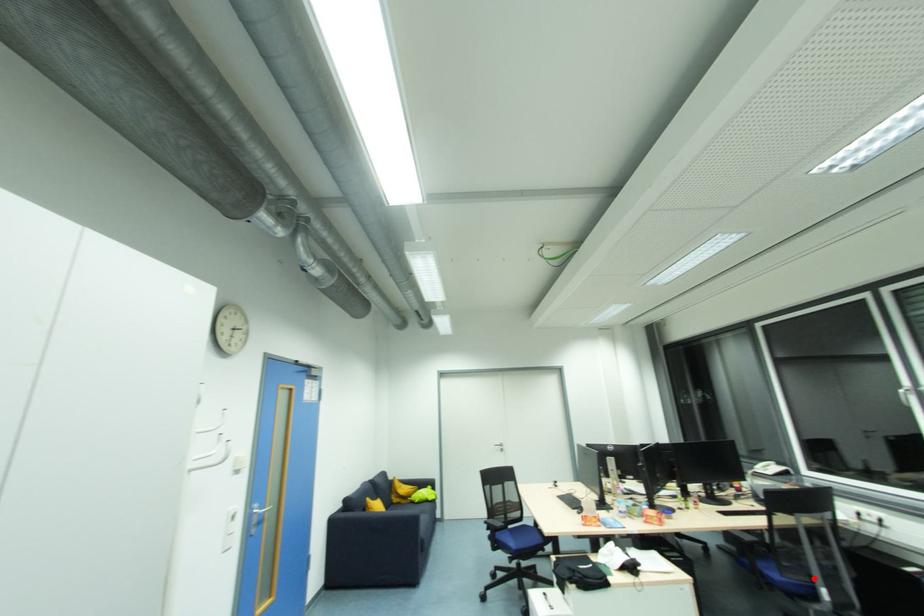
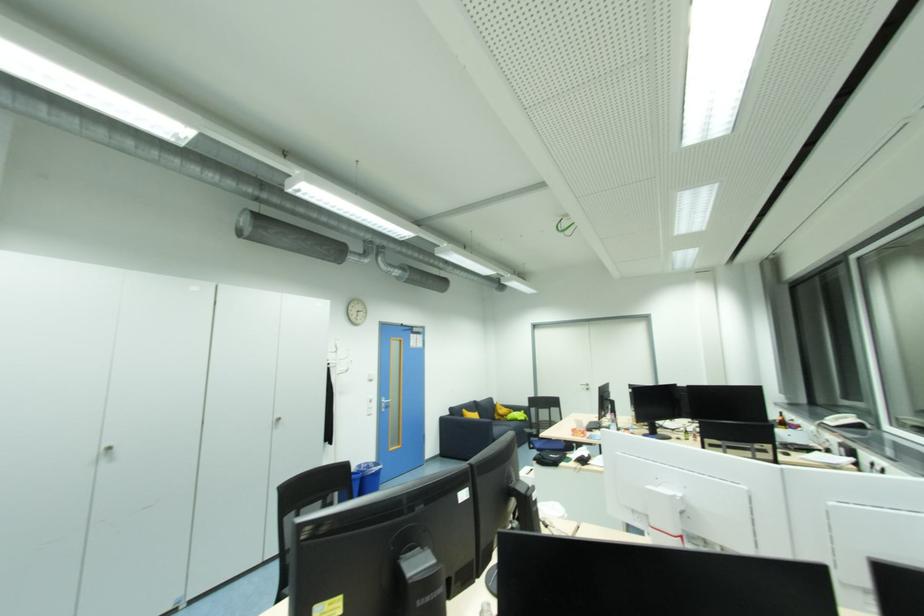
Question: I am providing you with two images of the same scene from different viewpoints. A red point is marked on the first image. Is the red point's position out of view in image 2?

Choices:
 (A) Yes
 (B) No

Answer: (A)